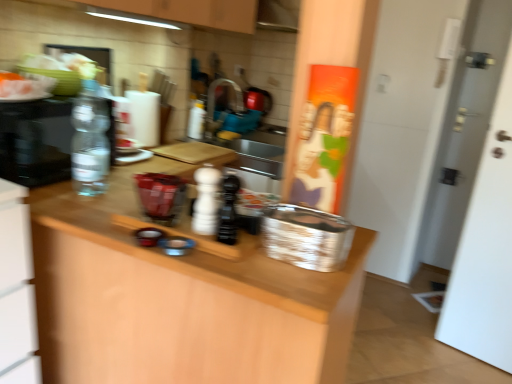
Identify the location of free space to the right of transparent plastic bottle at left, which ranks as the 1th bottle in left-to-right order. (122, 195).